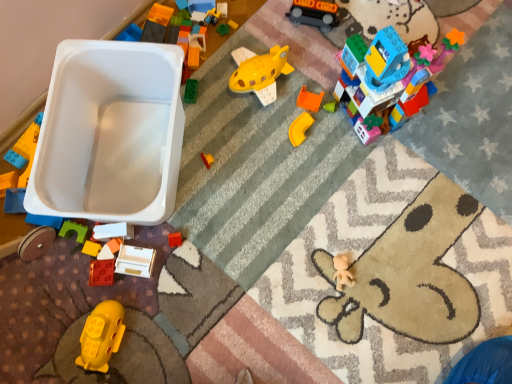
Identify the location of unoccupied area behind matte white drawer at lower center, which ranks as the third toy in bottom-to-top order. (140, 200).